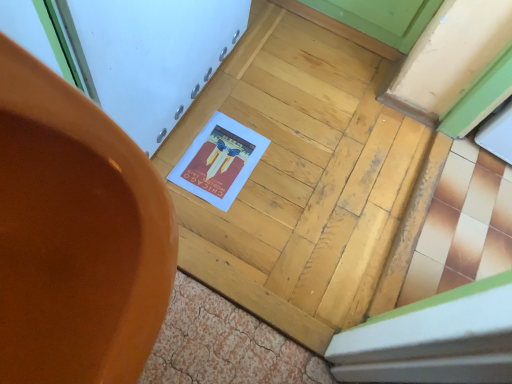
Question: From a real-world perspective, is wooden door at center physically located above or below matte orange pot at center?

Choices:
 (A) below
 (B) above

Answer: (A)

Question: From their relative heights in the image, would you say wooden door at center is taller or shorter than matte orange pot at center?

Choices:
 (A) short
 (B) tall

Answer: (A)

Question: Considering the positions of wooden door at center and matte orange pot at center in the image, is wooden door at center bigger or smaller than matte orange pot at center?

Choices:
 (A) small
 (B) big

Answer: (A)

Question: Based on their positions, is matte orange pot at center located to the left or right of wooden door at center?

Choices:
 (A) right
 (B) left

Answer: (B)

Question: Is matte orange pot at center situated inside wooden door at center or outside?

Choices:
 (A) inside
 (B) outside

Answer: (B)

Question: In terms of width, does matte orange pot at center look wider or thinner when compared to wooden door at center?

Choices:
 (A) thin
 (B) wide

Answer: (A)

Question: From the image's perspective, is matte orange pot at center located above or below wooden door at center?

Choices:
 (A) below
 (B) above

Answer: (A)